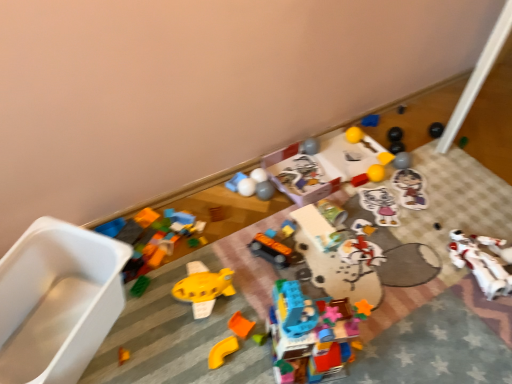
The height and width of the screenshot is (384, 512). Identify the location of vacant space to the left of orange matte plastic toy at lower center, the fifteenth toy viewed from the right. (168, 342).